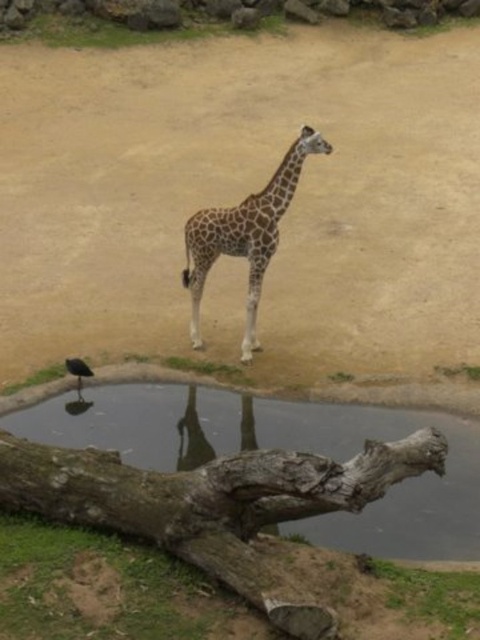
You are a visitor at the zoo and want to take a photo of the shiny black bird at lower left and the gray rough tree trunk at lower center. Which object should you focus on first if you want to capture both in the same frame without moving your camera?

You should focus on the shiny black bird at lower left first because the gray rough tree trunk at lower center is to the right of it, so adjusting the camera to include both would require framing from the left side where the bird is positioned.

You are a zookeeper trying to determine the best area to place a new feeding station. Considering the brown sandy dirt at center and the spotted fur giraffe at center, which area has more space available for the station?

The brown sandy dirt at center has more space available because it is bigger than the spotted fur giraffe at center.

You are a zookeeper observing the giraffe and the tree trunk in the enclosure. From your vantage point, which object is closer to you, the gray rough tree trunk at lower center or the spotted fur giraffe at center?

The gray rough tree trunk at lower center is closer to you because it is positioned in front of the spotted fur giraffe at center.